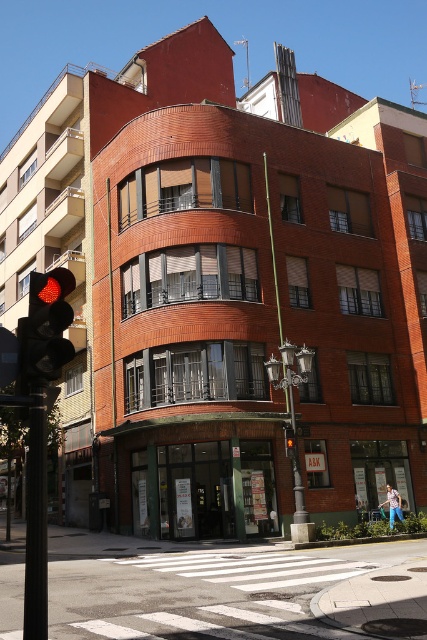
Which is behind, point (301, 369) or point (292, 456)?

The point (292, 456) is more distant.

Where is `green metal streetlight at center`? This screenshot has height=640, width=427. green metal streetlight at center is located at coordinates (289, 390).

From the picture: Is red glass traffic light at left thinner than green metal streetlight at center?

Correct, red glass traffic light at left's width is less than green metal streetlight at center's.

Who is more forward, (58,364) or (292,372)?

Point (58,364) is more forward.

Is point (31, 301) in front of point (297, 474)?

Yes, point (31, 301) is closer to viewer.

This screenshot has width=427, height=640. What are the coordinates of `red glass traffic light at left` in the screenshot? It's located at (47, 324).

Does black metal pole at left have a larger size compared to green metal streetlight at center?

Incorrect, black metal pole at left is not larger than green metal streetlight at center.

The image size is (427, 640). In order to click on black metal pole at left in this screenshot , I will do `click(35, 518)`.